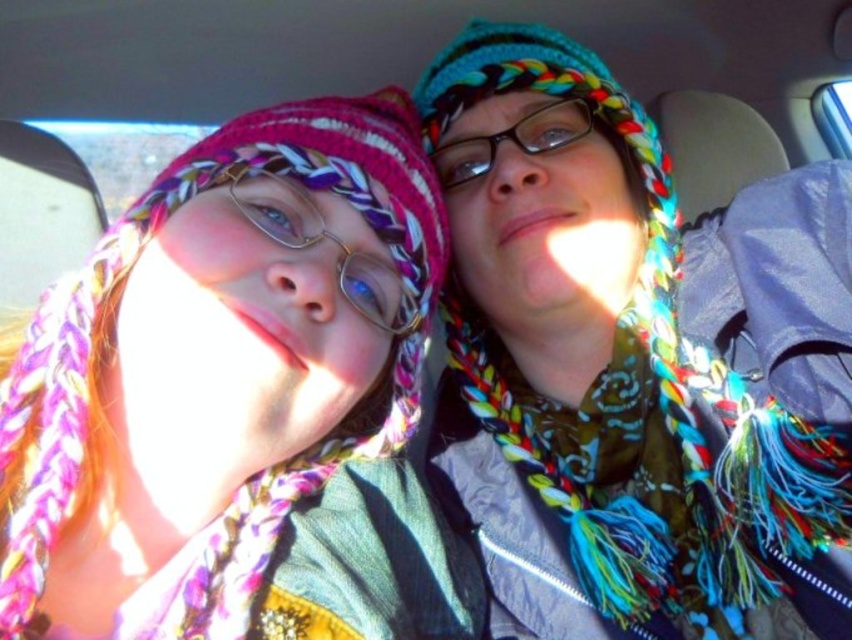
Can you confirm if multicolored knitted hat at center is bigger than matte pink scarf at left?

Yes, multicolored knitted hat at center is bigger than matte pink scarf at left.

Find the location of `multicolored knitted hat at center`. multicolored knitted hat at center is located at coordinates 634,364.

Which is more to the left, multicolored knitted hat at center or transparent plastic glasses at center?

Positioned to the left is transparent plastic glasses at center.

Is multicolored knitted hat at center to the right of transparent plastic glasses at center from the viewer's perspective?

Indeed, multicolored knitted hat at center is positioned on the right side of transparent plastic glasses at center.

Between point (689, 298) and point (563, 131), which one is positioned behind?

Positioned behind is point (563, 131).

Where is `multicolored knitted hat at center`? Image resolution: width=852 pixels, height=640 pixels. multicolored knitted hat at center is located at coordinates (634, 364).

Is point (412, 276) positioned after point (491, 157)?

No, (412, 276) is in front of (491, 157).

From the picture: Can you confirm if matte pink scarf at left is taller than transparent plastic glasses at center?

Correct, matte pink scarf at left is much taller as transparent plastic glasses at center.

Between point (110, 355) and point (542, 120), which one is positioned in front?

Point (110, 355) is more forward.

At what (x,y) coordinates should I click in order to perform the action: click on matte pink scarf at left. Please return your answer as a coordinate pair (x, y). The height and width of the screenshot is (640, 852). Looking at the image, I should click on (239, 401).